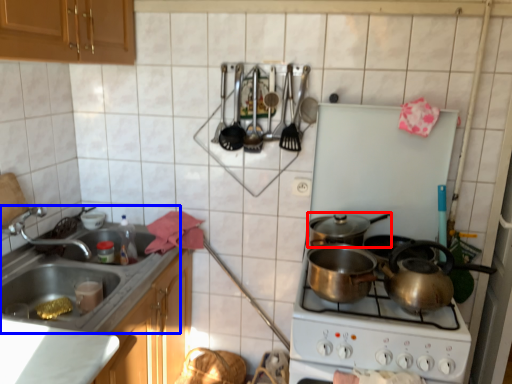
Question: Which object is further to the camera taking this photo, kitchen appliance (highlighted by a red box) or sink (highlighted by a blue box)?

Choices:
 (A) kitchen appliance
 (B) sink

Answer: (A)